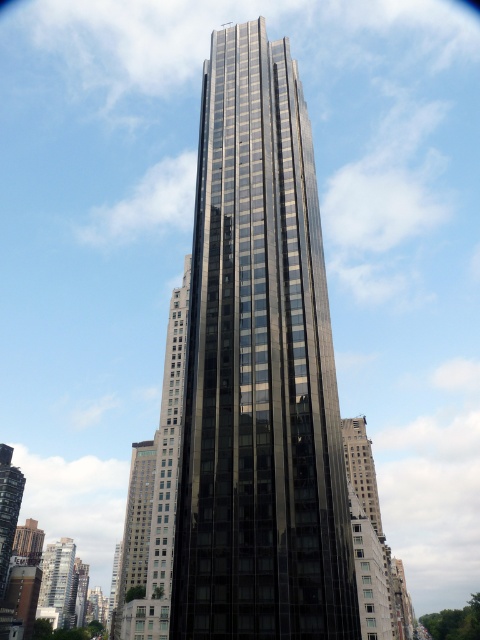
You are an architect analyzing the urban layout. Based on the image, which object is positioned higher in the scene? The shiny glass skyscraper at center or the glassy reflective building at lower left?

The shiny glass skyscraper at center is positioned higher in the scene than the glassy reflective building at lower left.

You are standing at a viewpoint where the shiny glass skyscraper at center is in full view. If you want to take a photo of it with your camera, which is 275 feet away from the building, will you be able to capture the entire structure in one shot?

The shiny glass skyscraper at center and camera are 275.46 feet apart from each other. Since the distance is exactly 275 feet, you can capture the entire structure in one shot as the camera is positioned at the correct distance.

You are standing on the sidewalk in front of the shiny glass skyscraper at center and the glassy reflective building at lower left. Which building is closer to you?

The shiny glass skyscraper at center is closer to you because it is positioned in front of the glassy reflective building at lower left.